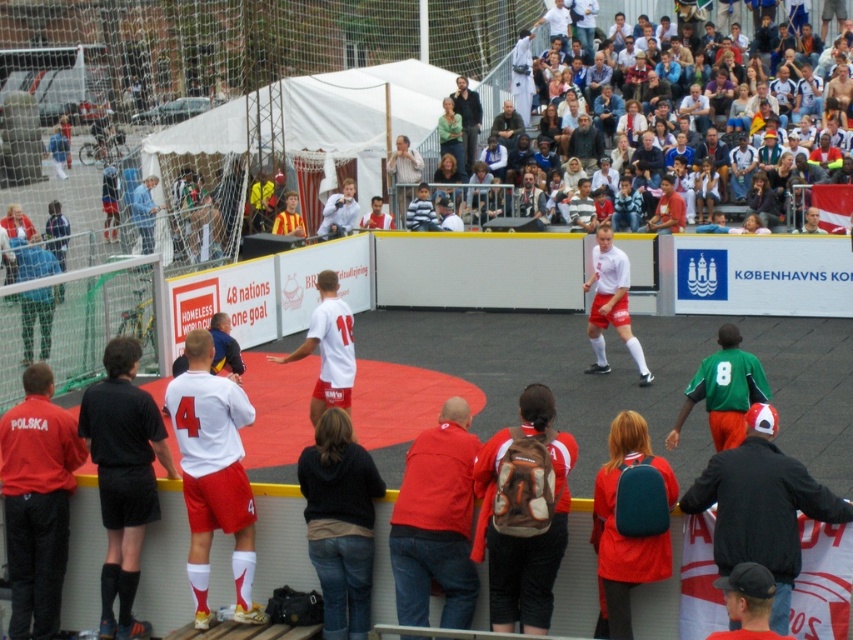
You are a photographer trying to capture a clear shot of the matte white shirt at center without the multicolored casual clothing at upper center blocking it. Based on their positions, can you adjust your angle to do so?

The multicolored casual clothing at upper center is in front of the matte white shirt at center, so adjusting your angle to focus behind the multicolored casual clothing at upper center might allow you to capture the matte white shirt at center without obstruction.

You are a photographer standing at the center of the soccer field. You want to take a photo that includes both the black leather jacket at lower right and the smooth brown leather jacket at upper center. Given that your camera has a maximum zoom range of 20 meters, will you be able to capture both jackets in the same frame without moving?

The distance between the black leather jacket at lower right and the smooth brown leather jacket at upper center is 21.47 meters. Since the camera can only zoom up to 20 meters, it won not be possible to capture both jackets in the same frame without moving.